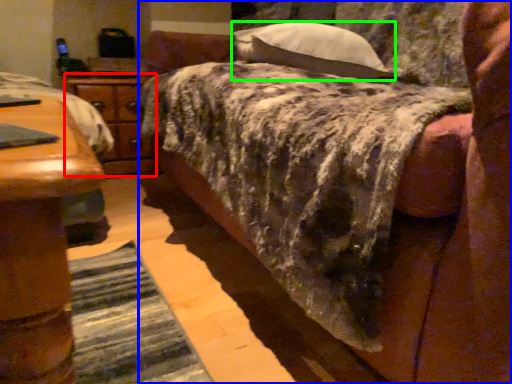
Question: Which object is positioned closest to nightstand (highlighted by a red box)? Select from bed (highlighted by a blue box) and pillow (highlighted by a green box).

Choices:
 (A) bed
 (B) pillow

Answer: (B)